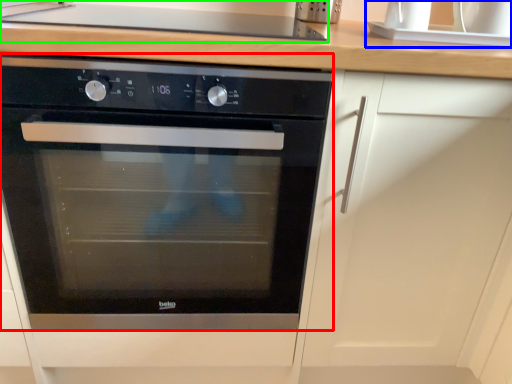
Question: Which object is the farthest from oven (highlighted by a red box)? Choose among these: sink (highlighted by a blue box) or gas stove (highlighted by a green box).

Choices:
 (A) sink
 (B) gas stove

Answer: (A)